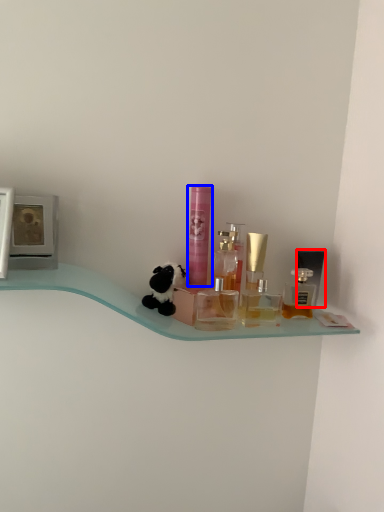
Question: Which object is closer to the camera taking this photo, toiletry (highlighted by a red box) or toiletry (highlighted by a blue box)?

Choices:
 (A) toiletry
 (B) toiletry

Answer: (B)